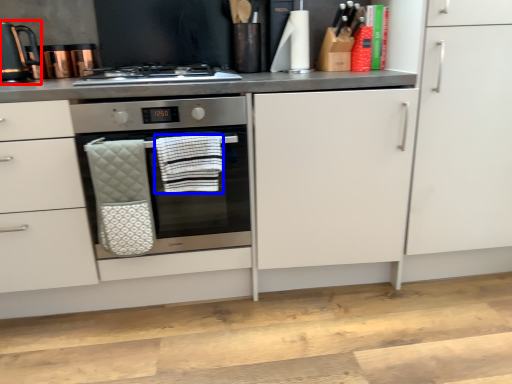
Question: Which of the following is the farthest to the observer, kitchen appliance (highlighted by a red box) or hand towel (highlighted by a blue box)?

Choices:
 (A) kitchen appliance
 (B) hand towel

Answer: (A)